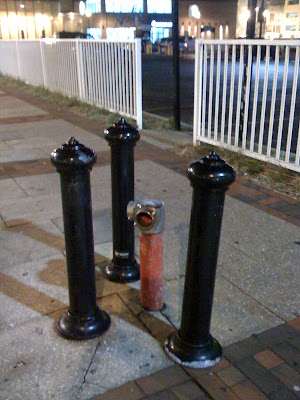
This screenshot has height=400, width=300. I want to click on white light, so click(122, 32), click(119, 6), click(162, 31).